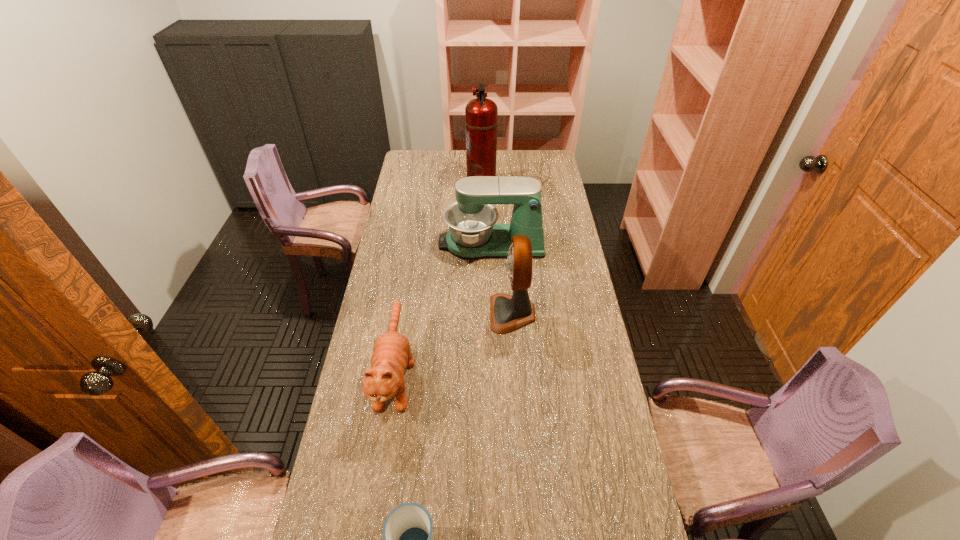
This screenshot has height=540, width=960. Identify the location of vacant region that satisfies the following two spatial constraints: 1. on the front-facing side of the fan; 2. on the face of the cat. (516, 373).